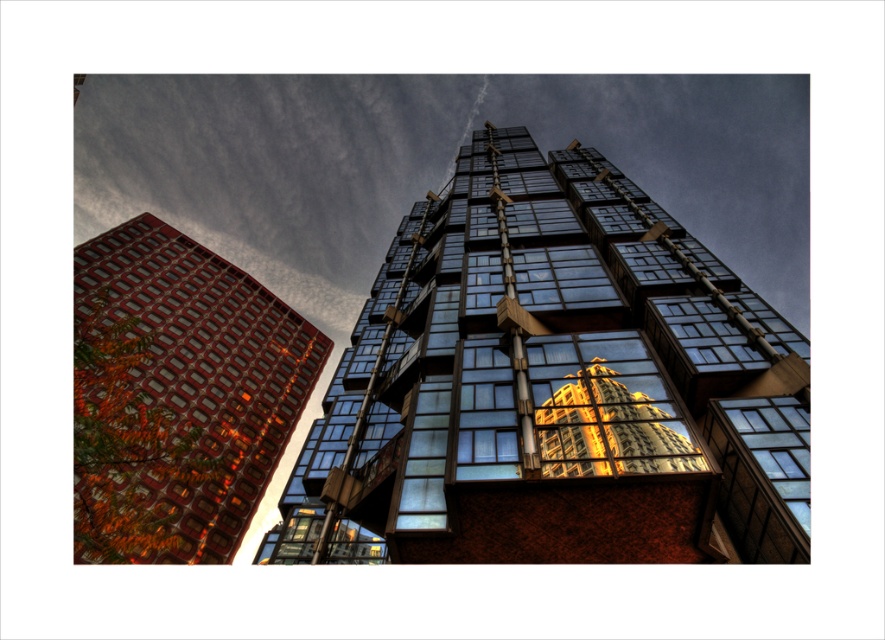
Who is more forward, (796, 540) or (166, 380)?

Point (796, 540) is in front.

Which is behind, point (633, 504) or point (201, 348)?

The point (201, 348) is behind.

Locate an element on the screen. glassy reflective building at center is located at coordinates (559, 384).

Is red brick building at left above glossy glass building at center?

No, red brick building at left is not above glossy glass building at center.

Who is higher up, red brick building at left or glossy glass building at center?

Positioned higher is glossy glass building at center.

Is point (196, 477) less distant than point (660, 444)?

No, (196, 477) is behind (660, 444).

Identify the location of red brick building at left. (204, 372).

Which is more to the right, glassy reflective building at center or glossy glass building at center?

From the viewer's perspective, glossy glass building at center appears more on the right side.

Does glassy reflective building at center appear on the right side of glossy glass building at center?

Incorrect, glassy reflective building at center is not on the right side of glossy glass building at center.

Is point (689, 348) positioned in front of point (675, 449)?

No.

Identify the location of glassy reflective building at center. (559, 384).